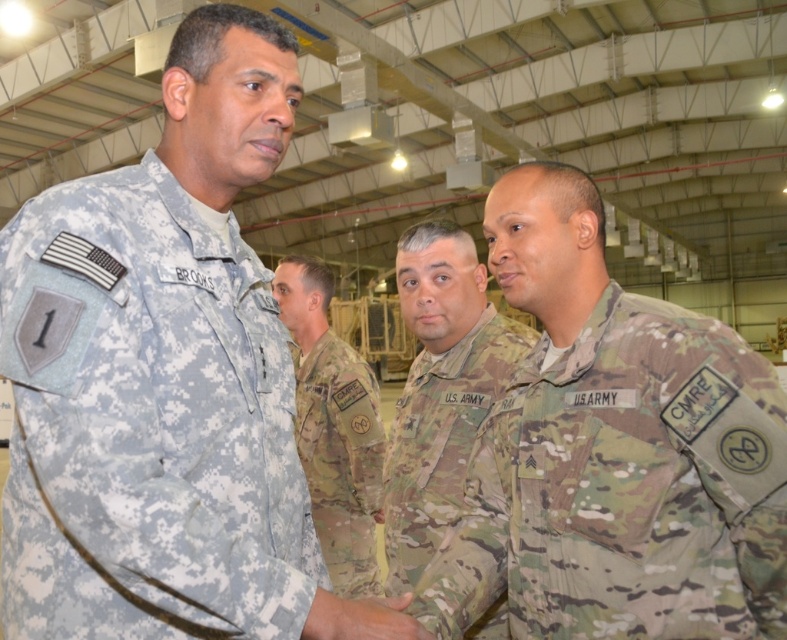
Question: Does camouflage fabric uniform at left have a lesser width compared to multicam uniform at center?

Choices:
 (A) no
 (B) yes

Answer: (A)

Question: Among these points, which one is farthest from the camera?

Choices:
 (A) [x=379, y=573]
 (B) [x=490, y=342]
 (C) [x=191, y=470]

Answer: (A)

Question: Which point is closer to the camera?

Choices:
 (A) camouflage fabric uniform at center
 (B) camouflage uniform at center

Answer: (B)

Question: Can you confirm if camouflage fabric uniform at left is smaller than camouflage fabric uniform at center?

Choices:
 (A) yes
 (B) no

Answer: (A)

Question: Observing the image, what is the correct spatial positioning of camouflage uniform at center in reference to camouflage fabric uniform at center?

Choices:
 (A) below
 (B) above

Answer: (B)

Question: Which of the following is the farthest from the observer?

Choices:
 (A) (401, 429)
 (B) (749, 433)
 (C) (24, 472)
 (D) (337, 467)

Answer: (D)